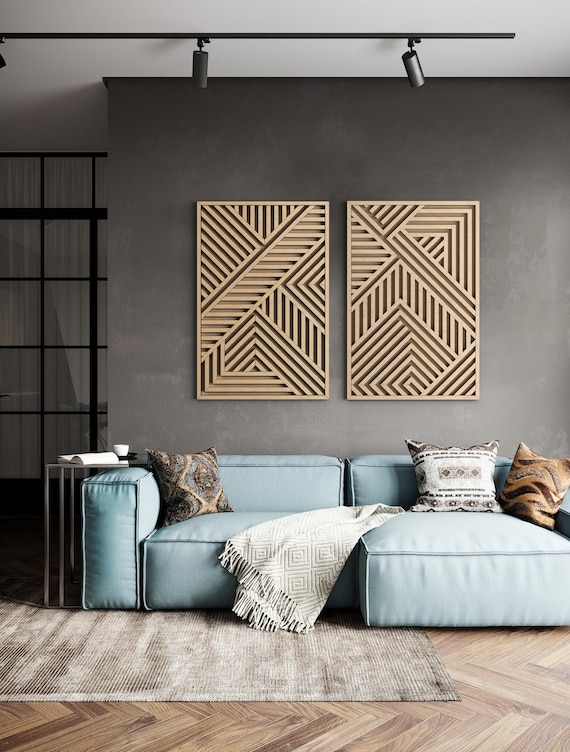
Find the location of a particular element. This screenshot has height=752, width=570. gray wall is located at coordinates [514, 307].